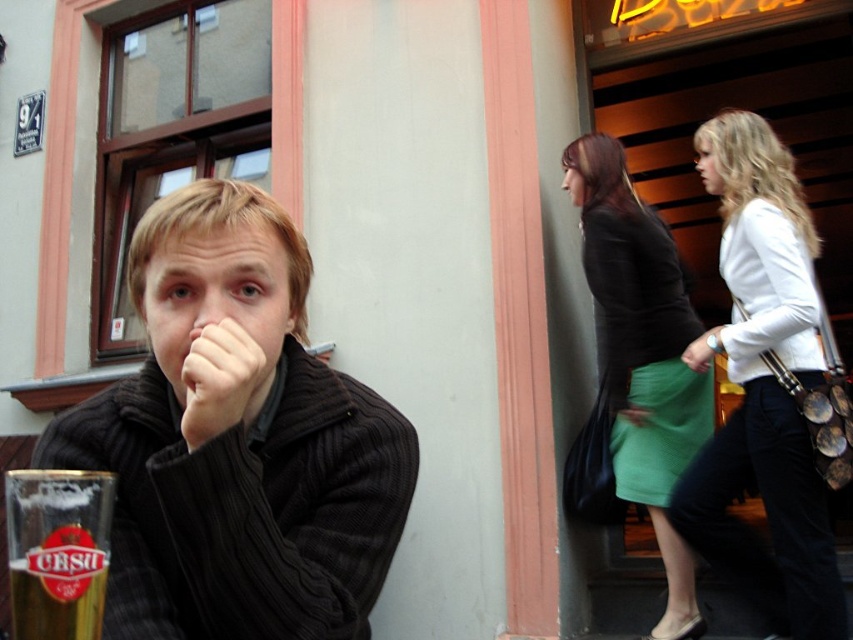
Question: Does dark brown sweater at center appear under green fabric skirt at center?

Choices:
 (A) no
 (B) yes

Answer: (A)

Question: Which point is closer to the camera?

Choices:
 (A) (250, 336)
 (B) (618, 465)
 (C) (343, 472)

Answer: (A)

Question: Is dark brown sweater at center wider than white leather jacket at center?

Choices:
 (A) no
 (B) yes

Answer: (B)

Question: Which object is positioned closest to the translucent glass beer at lower left?

Choices:
 (A) dark brown sweater at center
 (B) green fabric skirt at center
 (C) matte brown nose at center

Answer: (A)

Question: Can you confirm if white leather jacket at center is wider than translucent glass beer at lower left?

Choices:
 (A) no
 (B) yes

Answer: (B)

Question: Which is farther from the matte brown nose at center?

Choices:
 (A) matte black hand at center
 (B) dark brown sweater at center
 (C) white leather jacket at center
 (D) green fabric skirt at center

Answer: (D)